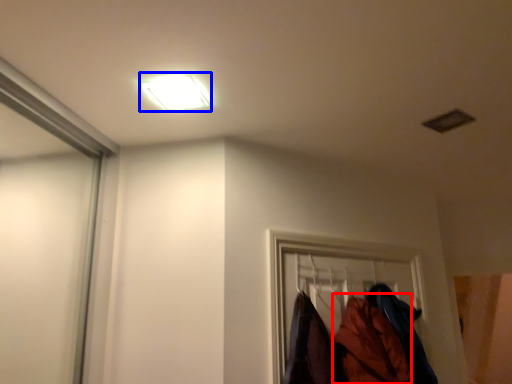
Question: Which of the following is the closest to the observer, clothing (highlighted by a red box) or lamp (highlighted by a blue box)?

Choices:
 (A) clothing
 (B) lamp

Answer: (B)